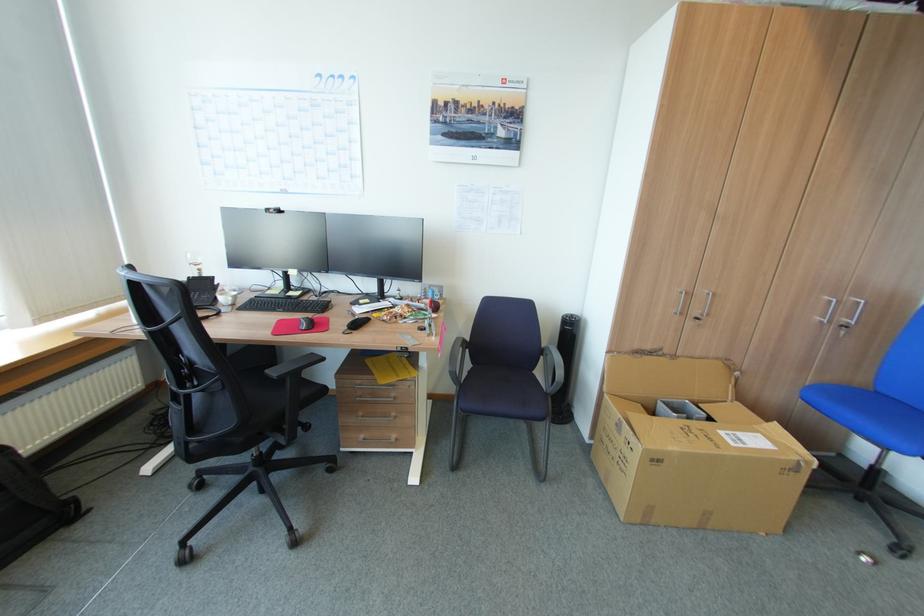
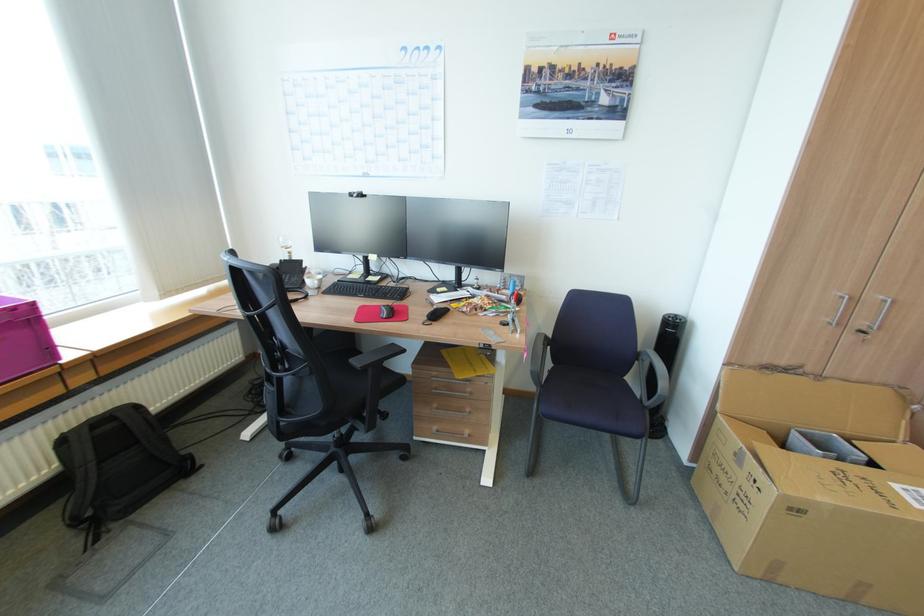
Find the pixel in the second image that matches [354,325] in the first image.

(432, 315)